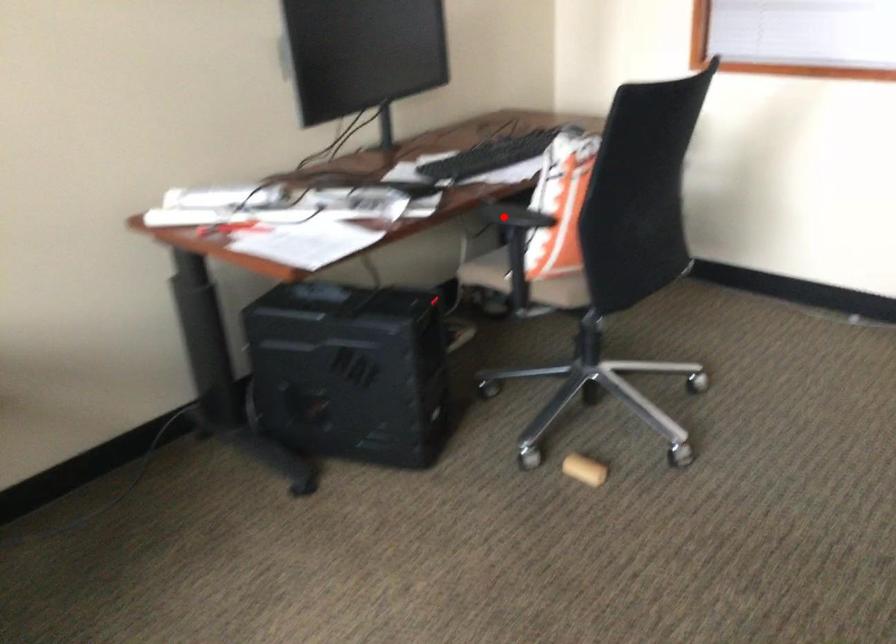
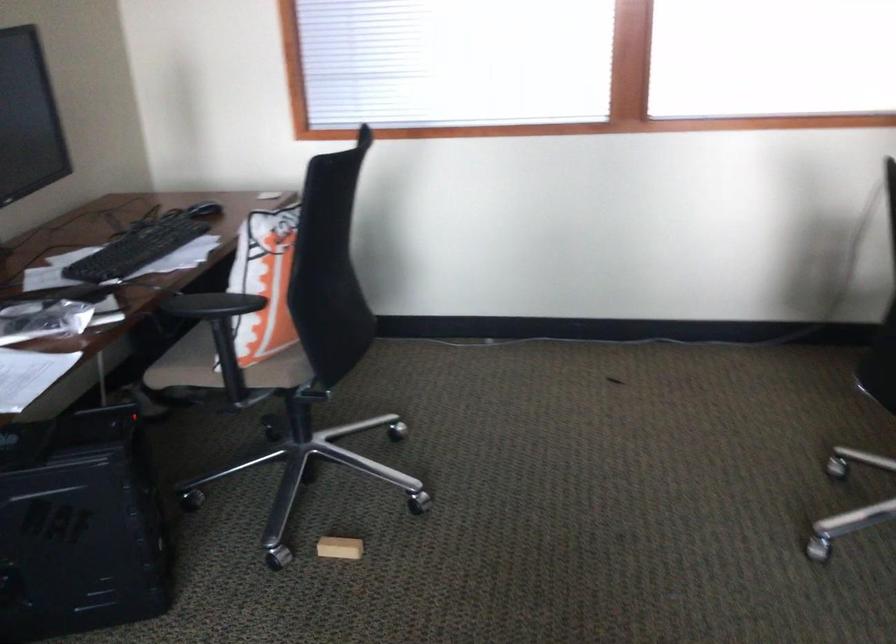
Question: I am providing you with two images of the same scene from different viewpoints. Given a red point in image1, look at the same physical point in image2. Is it:

Choices:
 (A) Closer to the viewpoint
 (B) Farther from the viewpoint

Answer: (A)